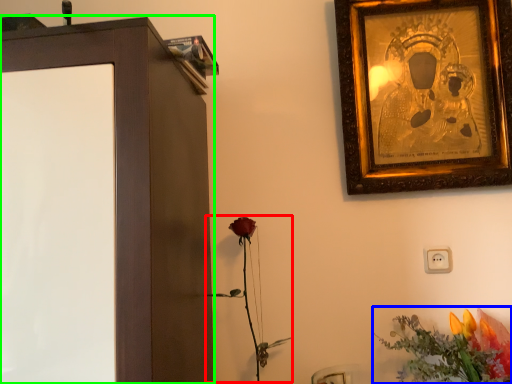
Question: Based on their relative distances, which object is nearer to plant (highlighted by a red box)? Choose from flower (highlighted by a blue box) and furniture (highlighted by a green box).

Choices:
 (A) flower
 (B) furniture

Answer: (B)